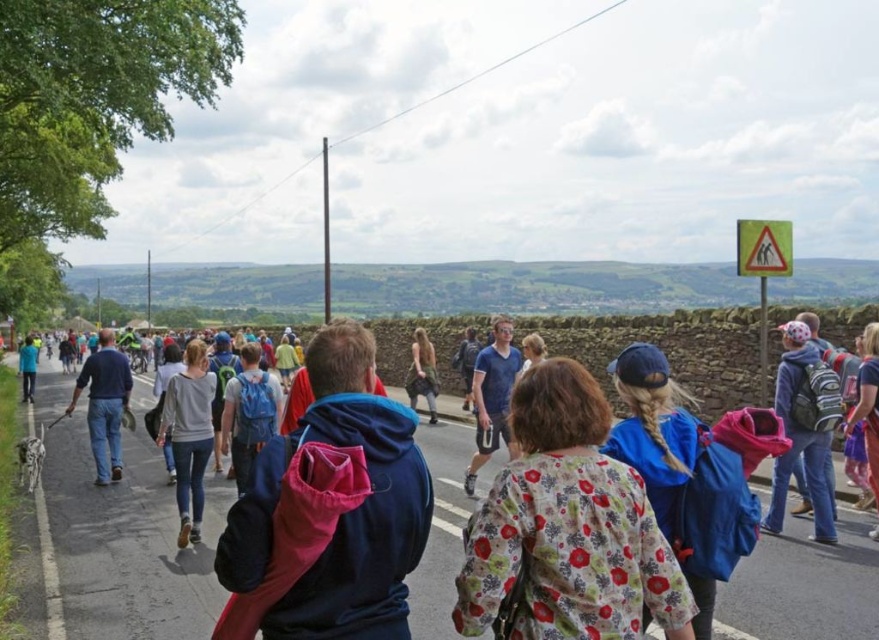
Between blue hooded sweatshirt at center and floral fabric jacket at center, which one has less height?

With less height is blue hooded sweatshirt at center.

Who is positioned more to the left, blue hooded sweatshirt at center or floral fabric jacket at center?

From the viewer's perspective, blue hooded sweatshirt at center appears more on the left side.

Is point (207, 508) closer to viewer compared to point (506, 579)?

No, (207, 508) is further to viewer.

At what (x,y) coordinates should I click in order to perform the action: click on blue hooded sweatshirt at center. Please return your answer as a coordinate pair (x, y). Image resolution: width=879 pixels, height=640 pixels. Looking at the image, I should click on (127, 540).